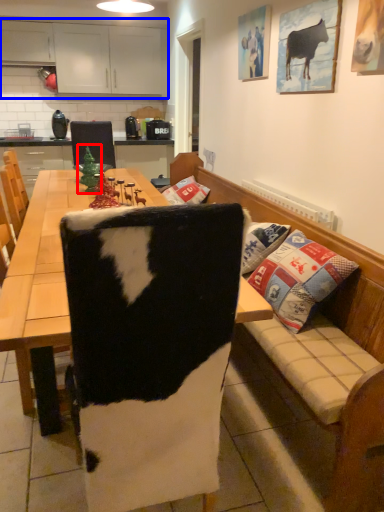
Question: Which of the following is the closest to the observer, christmas tree (highlighted by a red box) or cabinetry (highlighted by a blue box)?

Choices:
 (A) christmas tree
 (B) cabinetry

Answer: (A)